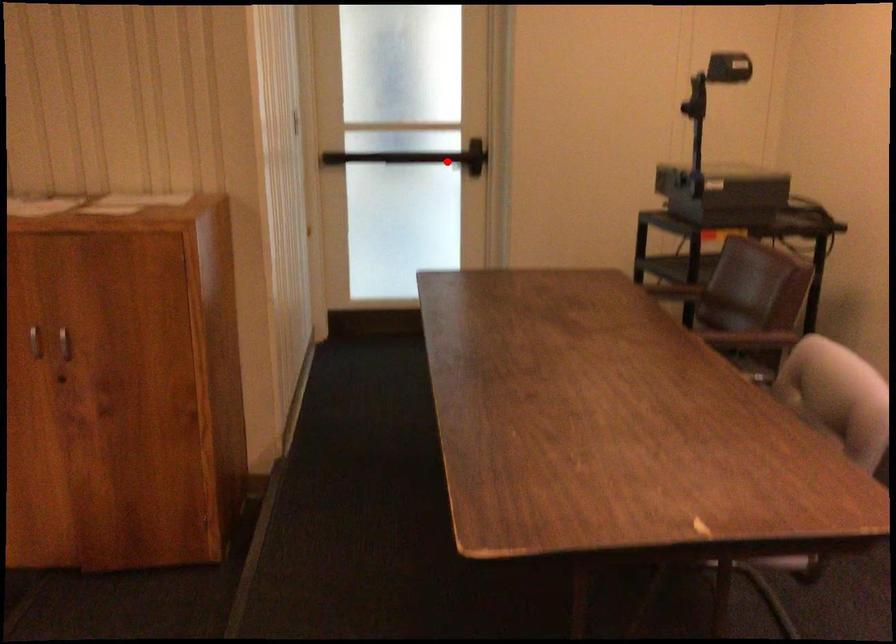
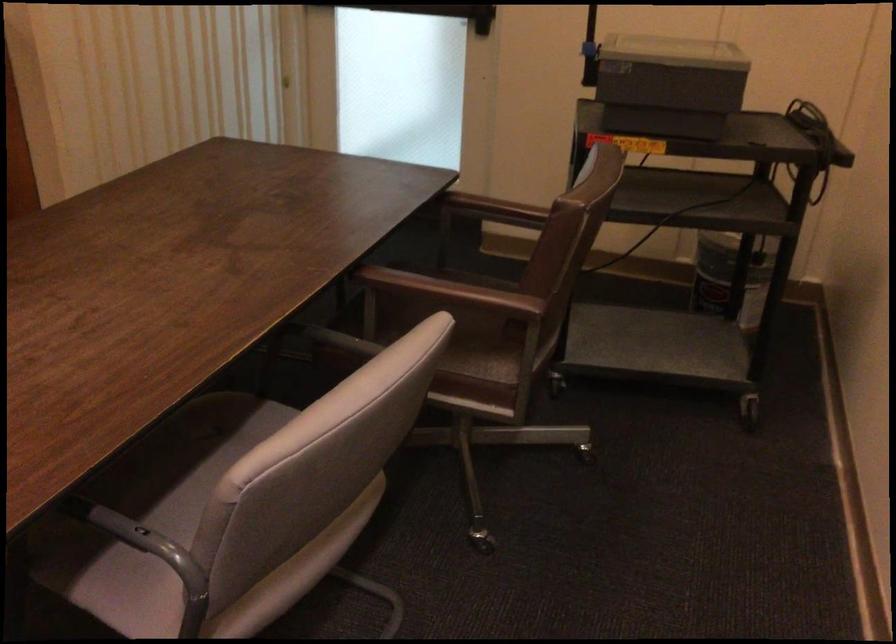
The point at the highlighted location is marked in the first image. Where is the corresponding point in the second image?

(437, 12)